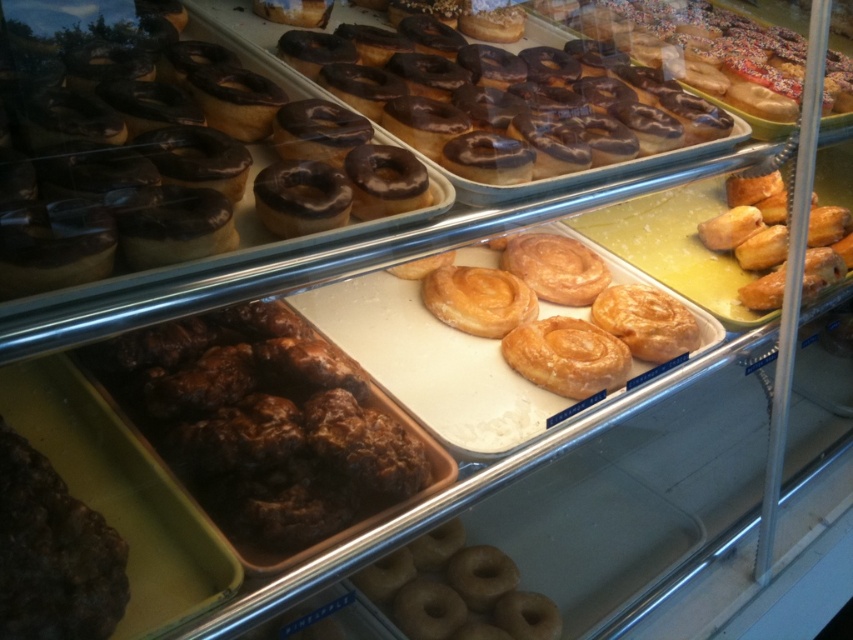
Does dark brown crumbly pastry at lower left appear over glazed doughnut at center?

Yes, dark brown crumbly pastry at lower left is above glazed doughnut at center.

Can you confirm if dark brown crumbly pastry at lower left is positioned to the right of glazed doughnut at center?

No, dark brown crumbly pastry at lower left is not to the right of glazed doughnut at center.

What do you see at coordinates (53, 554) in the screenshot? I see `dark brown crumbly pastry at lower left` at bounding box center [53, 554].

Identify the location of dark brown crumbly pastry at lower left. The height and width of the screenshot is (640, 853). (53, 554).

Between dark brown crumbly pastry at lower left and golden crispy pastry at right, which one has less height?

Standing shorter between the two is dark brown crumbly pastry at lower left.

How much distance is there between dark brown crumbly pastry at lower left and golden crispy pastry at right?

dark brown crumbly pastry at lower left is 4.66 feet away from golden crispy pastry at right.

Describe the element at coordinates (53, 554) in the screenshot. The width and height of the screenshot is (853, 640). I see `dark brown crumbly pastry at lower left` at that location.

The height and width of the screenshot is (640, 853). What are the coordinates of `dark brown crumbly pastry at lower left` in the screenshot? It's located at (53, 554).

Is shiny chocolate donut at upper left thinner than brown glazed donuts at center?

Incorrect, shiny chocolate donut at upper left's width is not less than brown glazed donuts at center's.

Which is behind, point (79, 189) or point (338, 461)?

Point (338, 461)

The width and height of the screenshot is (853, 640). In order to click on shiny chocolate donut at upper left in this screenshot , I will do `click(144, 150)`.

This screenshot has width=853, height=640. What are the coordinates of `shiny chocolate donut at upper left` in the screenshot? It's located at (144, 150).